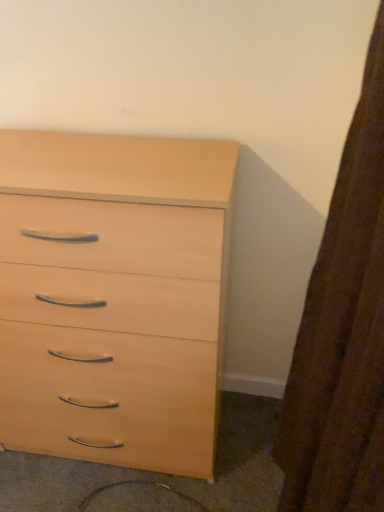
Measure the distance between light wood chest of drawers at center and camera.

The depth of light wood chest of drawers at center is 34.62 inches.

Locate an element on the screen. The height and width of the screenshot is (512, 384). light wood chest of drawers at center is located at coordinates (113, 296).

Identify the location of light wood drawer at lower center. (158, 473).

Is light wood chest of drawers at center next to brown textured curtain at right and touching it?

There is a gap between light wood chest of drawers at center and brown textured curtain at right.

From the image's perspective, which one is positioned higher, light wood chest of drawers at center or brown textured curtain at right?

From the image's view, light wood chest of drawers at center is above.

Which is correct: light wood chest of drawers at center is inside brown textured curtain at right, or outside of it?

light wood chest of drawers at center cannot be found inside brown textured curtain at right.

Between light wood chest of drawers at center and brown textured curtain at right, which one has smaller width?

brown textured curtain at right is thinner.

Based on the photo, between light wood drawer at lower center and light wood chest of drawers at center, which one has larger size?

light wood chest of drawers at center.

This screenshot has width=384, height=512. Identify the location of chest of drawers in front of the light wood drawer at lower center. (113, 296).

Is light wood drawer at lower center touching light wood chest of drawers at center?

There is a gap between light wood drawer at lower center and light wood chest of drawers at center.

Considering the relative sizes of brown textured curtain at right and light wood drawer at lower center in the image provided, is brown textured curtain at right shorter than light wood drawer at lower center?

In fact, brown textured curtain at right may be taller than light wood drawer at lower center.

In the scene shown: From a real-world perspective, which is physically above, brown textured curtain at right or light wood drawer at lower center?

brown textured curtain at right is physically above.

Which object is thinner, brown textured curtain at right or light wood drawer at lower center?

With smaller width is brown textured curtain at right.

Are brown textured curtain at right and light wood drawer at lower center located far from each other?

brown textured curtain at right is near light wood drawer at lower center, not far away.

Which object is closer to the camera, light wood chest of drawers at center or light wood drawer at lower center?

light wood chest of drawers at center is closer to the camera.

Is light wood chest of drawers at center wider than light wood drawer at lower center?

In fact, light wood chest of drawers at center might be narrower than light wood drawer at lower center.

Considering the sizes of objects light wood chest of drawers at center and light wood drawer at lower center in the image provided, who is bigger, light wood chest of drawers at center or light wood drawer at lower center?

With larger size is light wood chest of drawers at center.

From a real-world perspective, between brown textured curtain at right and light wood chest of drawers at center, who is vertically higher?

From a 3D spatial view, brown textured curtain at right is above.

Is brown textured curtain at right oriented away from light wood chest of drawers at center?

brown textured curtain at right is not turned away from light wood chest of drawers at center.

How distant is brown textured curtain at right from light wood chest of drawers at center?

They are 20.24 inches apart.

Considering the sizes of brown textured curtain at right and light wood chest of drawers at center in the image, is brown textured curtain at right taller or shorter than light wood chest of drawers at center?

In the image, brown textured curtain at right appears to be shorter than light wood chest of drawers at center.

Identify the location of curtain that appears on the right of light wood drawer at lower center. (343, 332).

Is light wood drawer at lower center oriented away from brown textured curtain at right?

No, light wood drawer at lower center is not facing away from brown textured curtain at right.

Which is behind, light wood drawer at lower center or brown textured curtain at right?

light wood drawer at lower center is behind.

Are light wood drawer at lower center and brown textured curtain at right far apart?

Actually, light wood drawer at lower center and brown textured curtain at right are a little close together.

This screenshot has height=512, width=384. What are the coordinates of `curtain above the light wood chest of drawers at center (from a real-world perspective)` in the screenshot? It's located at (343, 332).

Where is `the chest of drawers that appears above the light wood drawer at lower center (from the image's perspective)`? This screenshot has width=384, height=512. the chest of drawers that appears above the light wood drawer at lower center (from the image's perspective) is located at coordinates (113, 296).

Considering their positions, is light wood chest of drawers at center positioned closer to light wood drawer at lower center than brown textured curtain at right?

Based on the image, light wood chest of drawers at center appears to be nearer to light wood drawer at lower center.

Considering their positions, is brown textured curtain at right positioned closer to light wood chest of drawers at center than light wood drawer at lower center?

light wood drawer at lower center.

Which object lies nearer to the anchor point light wood drawer at lower center, brown textured curtain at right or light wood chest of drawers at center?

Based on the image, light wood chest of drawers at center appears to be nearer to light wood drawer at lower center.

Estimate the real-world distances between objects in this image. Which object is closer to brown textured curtain at right, light wood chest of drawers at center or light wood drawer at lower center?

Based on the image, light wood chest of drawers at center appears to be nearer to brown textured curtain at right.

Considering their positions, is light wood drawer at lower center positioned further to light wood chest of drawers at center than brown textured curtain at right?

brown textured curtain at right lies further to light wood chest of drawers at center than the other object.

Estimate the real-world distances between objects in this image. Which object is closer to brown textured curtain at right, light wood drawer at lower center or light wood chest of drawers at center?

light wood chest of drawers at center.

Locate an element on the screen. The height and width of the screenshot is (512, 384). chest of drawers between brown textured curtain at right and light wood drawer at lower center in the front-back direction is located at coordinates (113, 296).